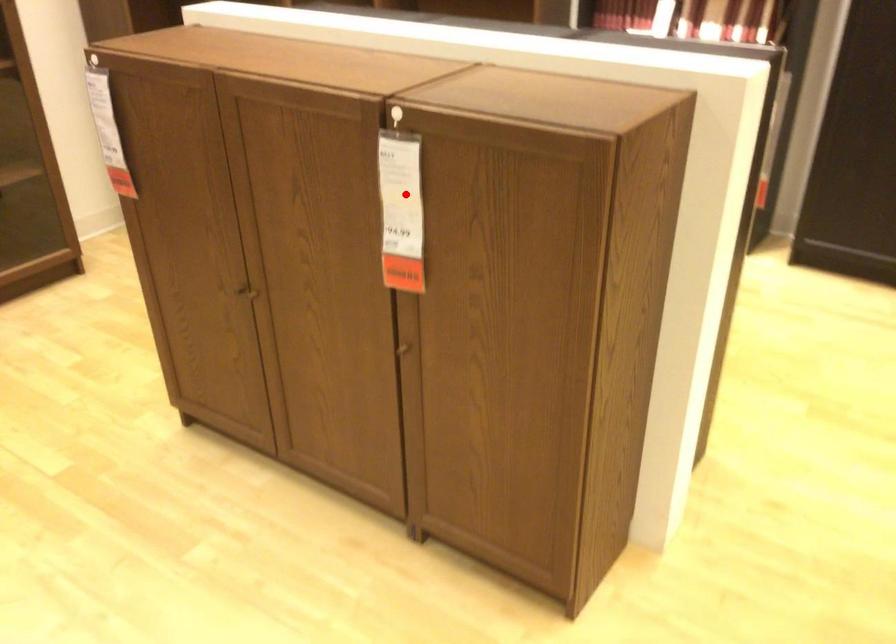
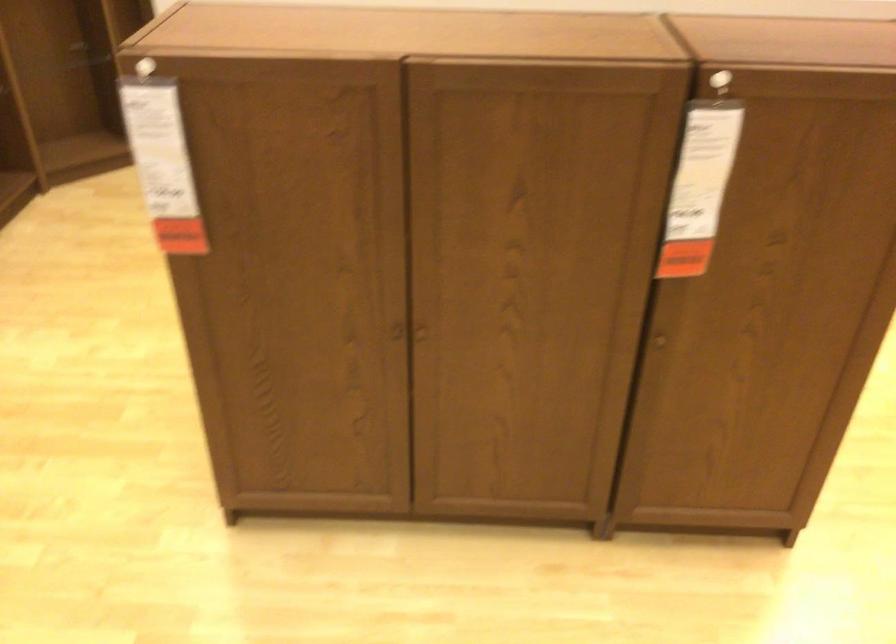
Question: I am providing you with two images of the same scene from different viewpoints. Given a red point in image1, look at the same physical point in image2. Is it:

Choices:
 (A) Closer to the viewpoint
 (B) Farther from the viewpoint

Answer: (A)